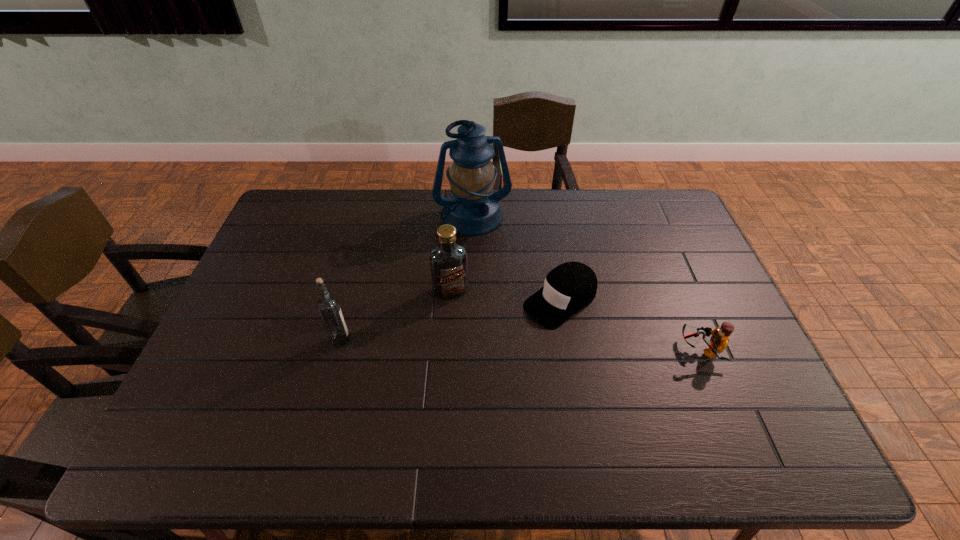
In the image, there is a desktop. Where is `blank space at the far right corner`? This screenshot has width=960, height=540. blank space at the far right corner is located at coordinates (653, 194).

In the image, there is a desktop. Identify the location of vacant space at the near right corner. (775, 409).

The height and width of the screenshot is (540, 960). I want to click on free space between the Lego and the right vodka, so click(x=575, y=320).

This screenshot has width=960, height=540. What are the coordinates of `unoccupied position between the left vodka and the cap` in the screenshot? It's located at [450, 321].

Locate an element on the screen. free space that is in between the right vodka and the nearer vodka is located at coordinates (396, 315).

Find the location of `vacant space in between the nearer vodka and the right vodka`. vacant space in between the nearer vodka and the right vodka is located at coordinates (396, 315).

The image size is (960, 540). What are the coordinates of `free spot between the right vodka and the left vodka` in the screenshot? It's located at (396, 315).

At what (x,y) coordinates should I click in order to perform the action: click on free point between the fourth object from left to right and the farther vodka. Please return your answer as a coordinate pair (x, y). The image size is (960, 540). Looking at the image, I should click on (506, 296).

Locate an element on the screen. The width and height of the screenshot is (960, 540). vacant region between the cap and the right vodka is located at coordinates (506, 296).

This screenshot has height=540, width=960. I want to click on empty space between the right vodka and the shortest object, so click(x=506, y=296).